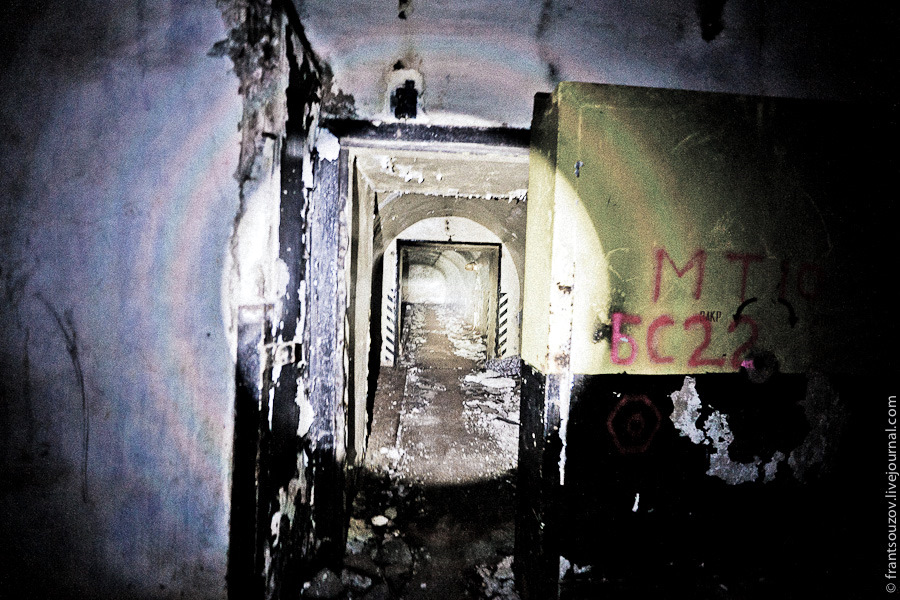
Locate an element on the screen. Image resolution: width=900 pixels, height=600 pixels. arched ceiling is located at coordinates (432, 215).